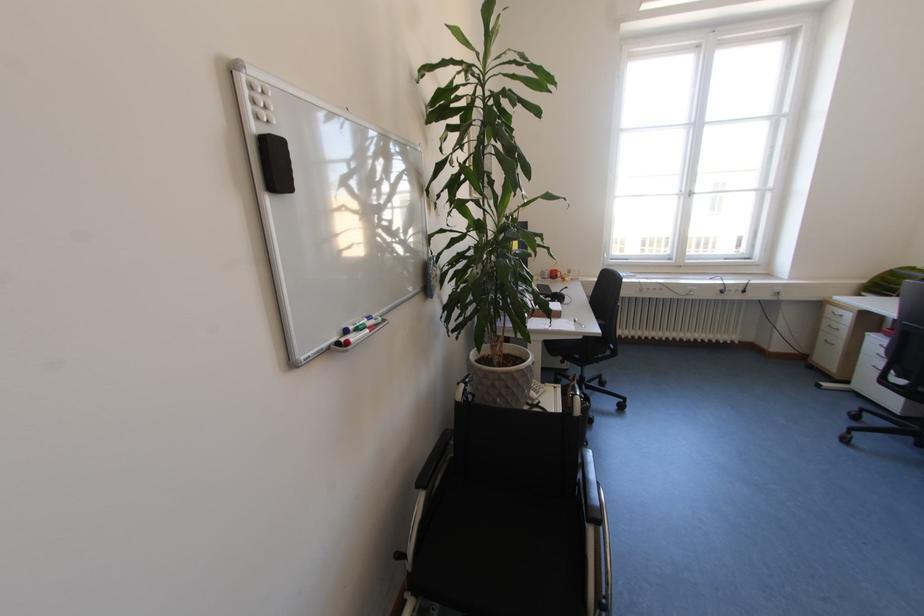
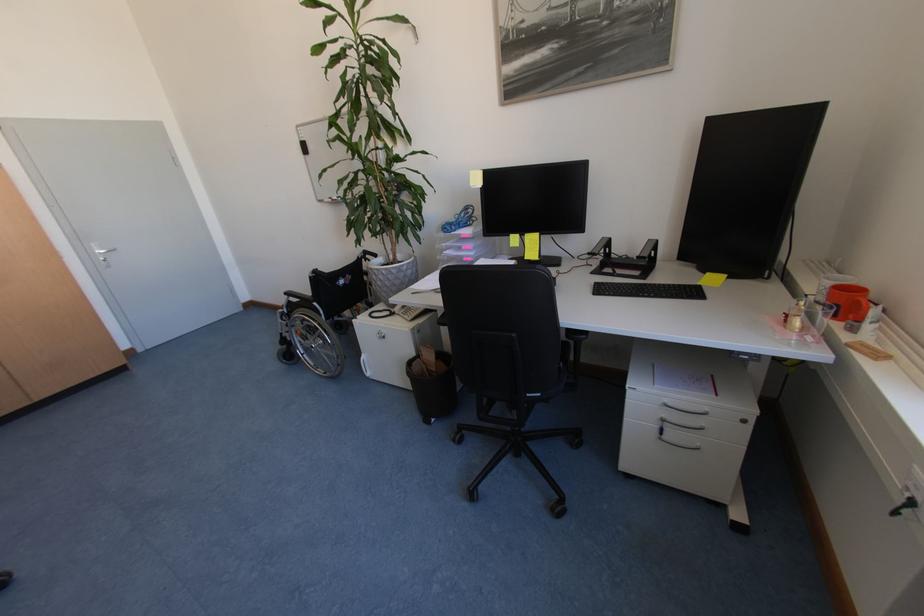
Where in the second image is the point corresponding to point (553, 278) from the first image?

(824, 300)